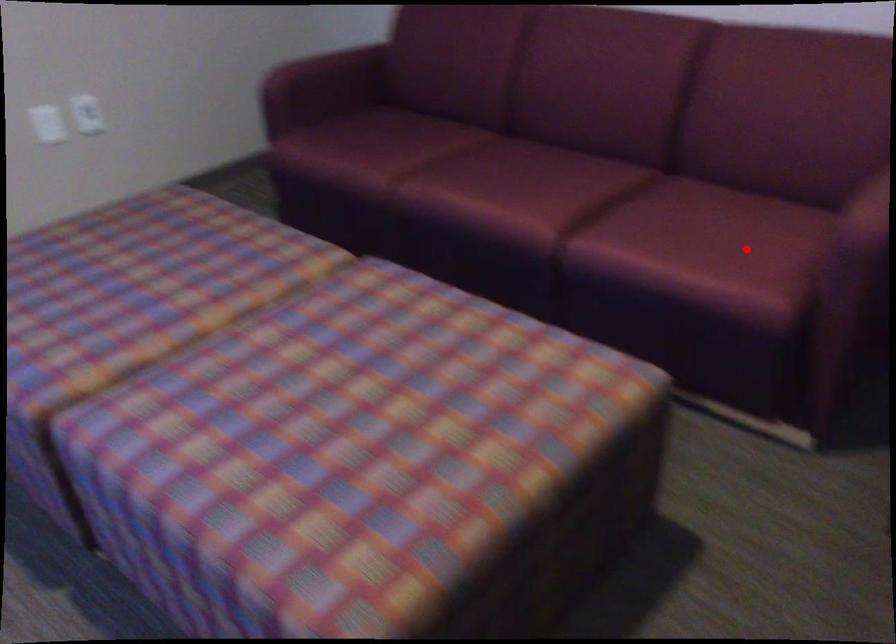
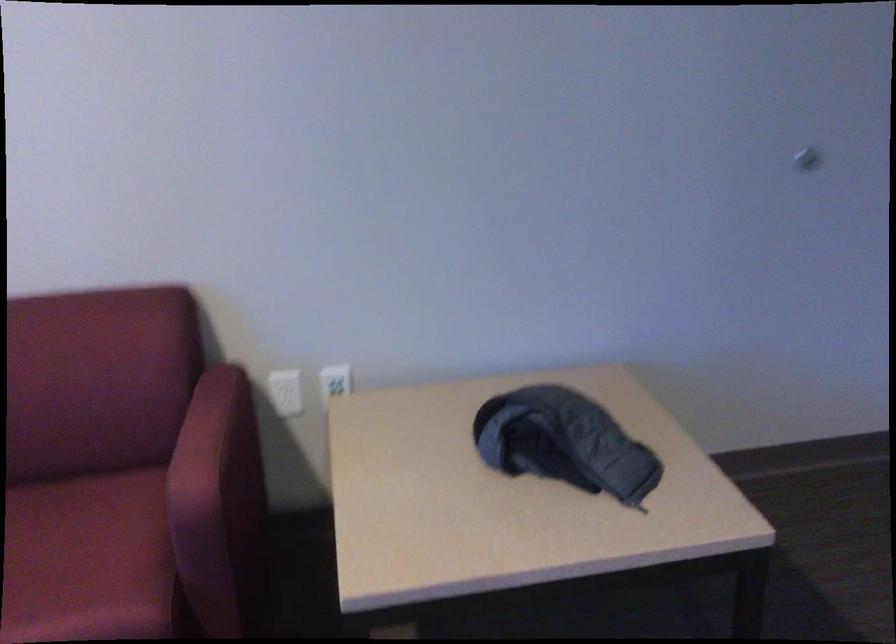
Question: I am providing you with two images of the same scene from different viewpoints. Given a red point in image1, look at the same physical point in image2. Is it:

Choices:
 (A) Closer to the viewpoint
 (B) Farther from the viewpoint

Answer: (A)